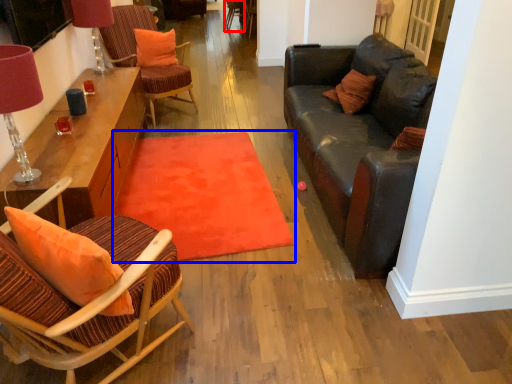
Question: Which object appears closest to the camera in this image, armchair (highlighted by a red box) or mat (highlighted by a blue box)?

Choices:
 (A) armchair
 (B) mat

Answer: (B)